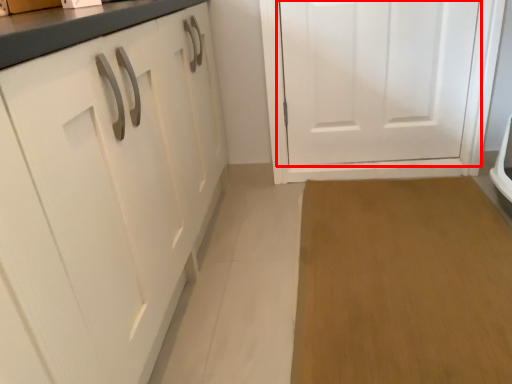
Question: From the image's perspective, considering the relative positions of door (annotated by the red box) and plain in the image provided, where is door (annotated by the red box) located with respect to the staircase?

Choices:
 (A) above
 (B) below

Answer: (A)